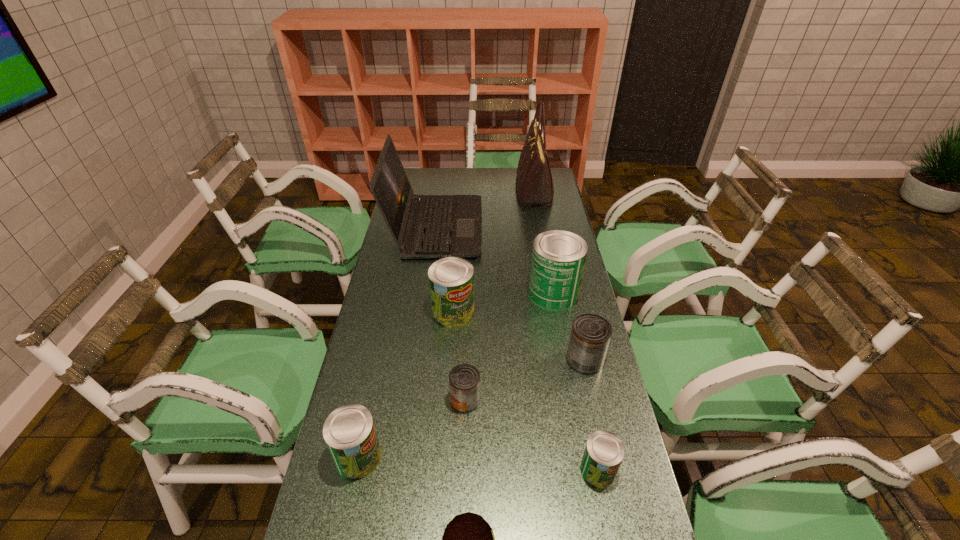
At what (x,y) coordinates should I click in order to perform the action: click on green can that stands as the third closest to the nearest object. Please return your answer as a coordinate pair (x, y). The width and height of the screenshot is (960, 540). Looking at the image, I should click on (451, 280).

This screenshot has width=960, height=540. In order to click on vacant space that satisfies the following two spatial constraints: 1. on the screen of the laptop_computer; 2. on the left side of the smallest green can in this screenshot , I will do `click(404, 470)`.

Find the location of a particular element. The width and height of the screenshot is (960, 540). vacant region that satisfies the following two spatial constraints: 1. on the screen of the sixth shortest object; 2. on the left side of the laptop_computer is located at coordinates (425, 312).